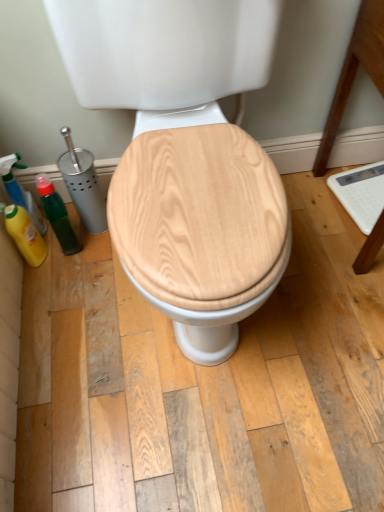
Find the location of a particular element. The width and height of the screenshot is (384, 512). empty space that is in between wooden toilet seat at center and yellow matte bottle at left, the second cleaning product when ordered from top to bottom is located at coordinates (88, 293).